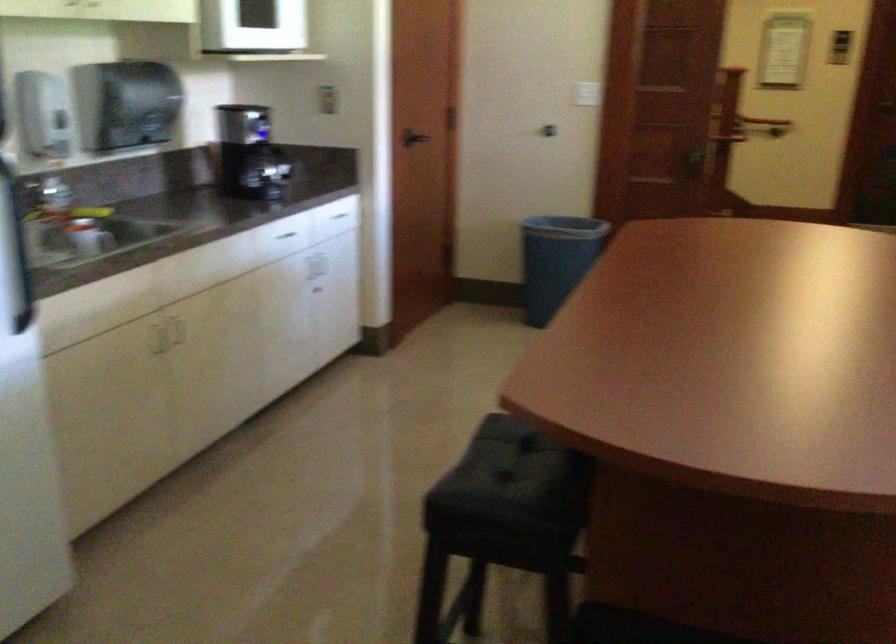
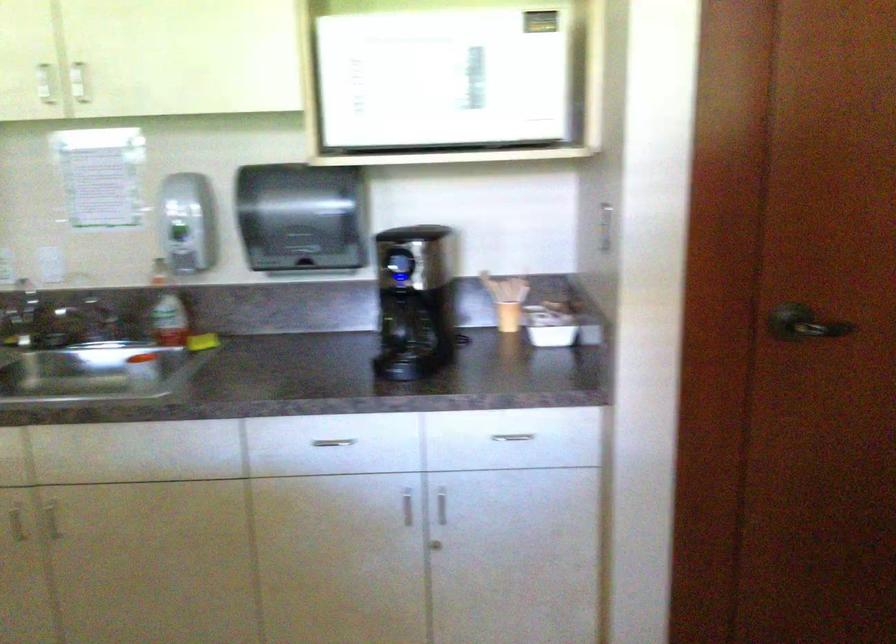
In the second image, find the point that corresponds to point (149, 355) in the first image.

(15, 522)